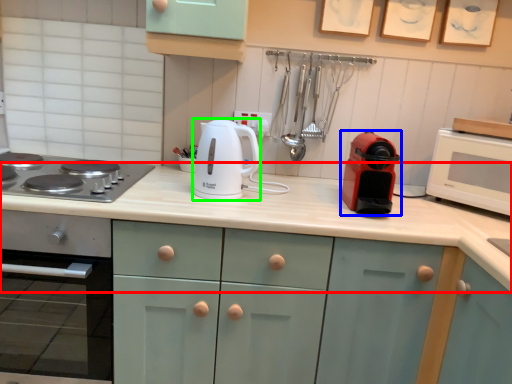
Question: Which object is positioned closest to countertop (highlighted by a red box)? Select from kitchen appliance (highlighted by a blue box) and kitchen appliance (highlighted by a green box).

Choices:
 (A) kitchen appliance
 (B) kitchen appliance

Answer: (A)